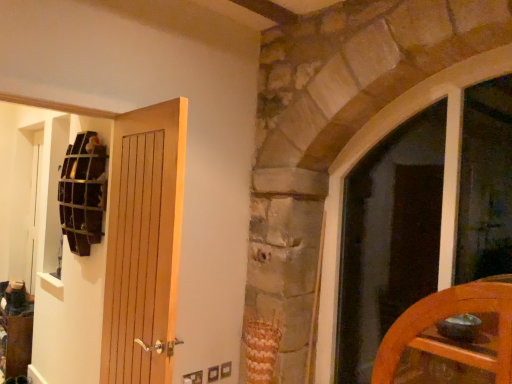
Question: Is matte glass window at right to the left of wooden door at left, placed as the 2th door when sorted from right to left, from the viewer's perspective?

Choices:
 (A) no
 (B) yes

Answer: (A)

Question: Can you confirm if matte glass window at right is smaller than wooden door at left, placed as the 2th door when sorted from right to left?

Choices:
 (A) yes
 (B) no

Answer: (B)

Question: From the image's perspective, is matte glass window at right above wooden door at left, placed as the 2th door when sorted from right to left?

Choices:
 (A) no
 (B) yes

Answer: (A)

Question: Is the depth of matte glass window at right less than that of wooden door at left, positioned as the first door in left-to-right order?

Choices:
 (A) no
 (B) yes

Answer: (A)

Question: Are matte glass window at right and wooden door at left, positioned as the first door in left-to-right order, far apart?

Choices:
 (A) yes
 (B) no

Answer: (A)

Question: Is point (423, 79) positioned closer to the camera than point (95, 240)?

Choices:
 (A) farther
 (B) closer

Answer: (B)

Question: Considering the relative positions of matte glass window at right and wooden grid at upper left in the image provided, is matte glass window at right to the left or to the right of wooden grid at upper left?

Choices:
 (A) right
 (B) left

Answer: (A)

Question: From the image's perspective, is matte glass window at right above or below wooden grid at upper left?

Choices:
 (A) above
 (B) below

Answer: (B)

Question: Do you think matte glass window at right is within wooden grid at upper left, or outside of it?

Choices:
 (A) inside
 (B) outside

Answer: (B)

Question: Considering their positions, is wooden door at left, placed as the 2th door when sorted from right to left, located in front of or behind wooden grid at upper left?

Choices:
 (A) front
 (B) behind

Answer: (A)

Question: From the image's perspective, relative to wooden grid at upper left, is wooden door at left, positioned as the first door in left-to-right order, above or below?

Choices:
 (A) above
 (B) below

Answer: (B)

Question: Is wooden door at left, placed as the 2th door when sorted from right to left, taller or shorter than wooden grid at upper left?

Choices:
 (A) tall
 (B) short

Answer: (A)

Question: Is wooden door at left, placed as the 2th door when sorted from right to left, to the left or to the right of wooden grid at upper left in the image?

Choices:
 (A) left
 (B) right

Answer: (B)

Question: Is wooden grid at upper left wider or thinner than wooden door at left, positioned as the first door in left-to-right order?

Choices:
 (A) wide
 (B) thin

Answer: (A)

Question: Considering the positions of point (64, 178) and point (175, 233), is point (64, 178) closer or farther from the camera than point (175, 233)?

Choices:
 (A) closer
 (B) farther

Answer: (B)